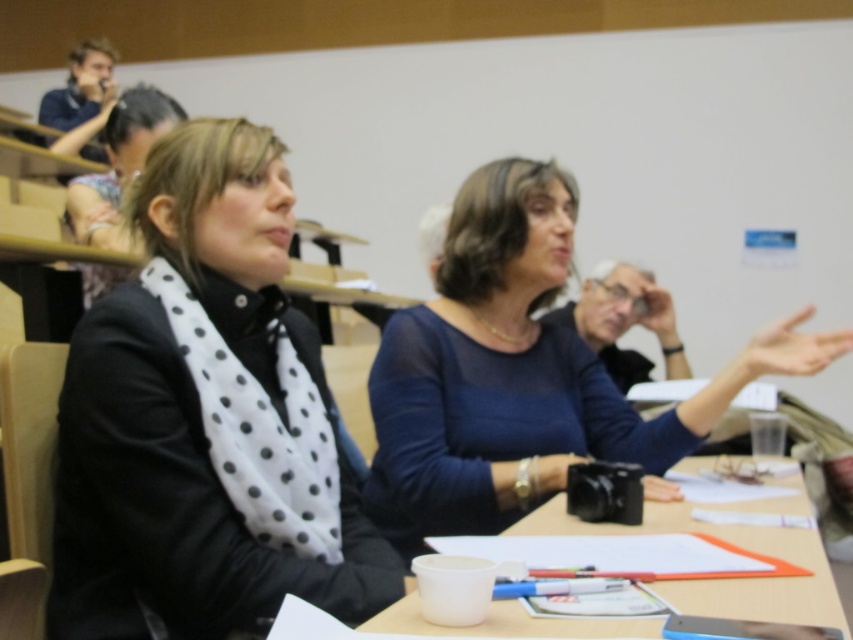
You are a photographer standing behind the camera at the desk. You want to take a photo of the white dotted scarf at center without moving the camera. Is it possible to capture the scarf in the frame?

The white dotted scarf at center is 37.04 inches away from the camera. Since the scarf is within the camera lens range, it can be captured in the frame without moving the camera.

You are a photographer trying to capture a candid shot of the blue sheer blouse at center and the white plastic cup at lower center. Which object should you focus on first if you want to ensure both are in focus without moving the camera?

The blue sheer blouse at center is located above the white plastic cup at lower center, so you should focus on the blue sheer blouse at center first to ensure both are in focus since it is closer to the camera.

You are a photographer standing at the entrance of the classroom. You want to take a photo of the white dotted scarf at center. Where should you position yourself to capture it in the frame?

The white dotted scarf at center is located at coordinates point (206, 419), so you should position yourself centrally to capture it in the frame.